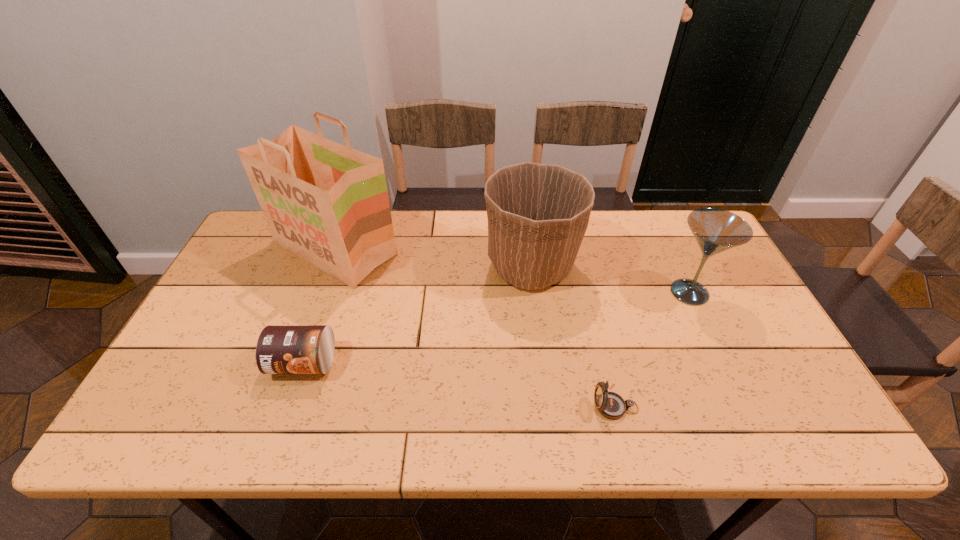
I want to click on free space located 0.160m on the face of the compass, so (x=522, y=407).

Identify the location of vacant region located 0.210m on the face of the compass. (500, 407).

Locate an element on the screen. The image size is (960, 540). vacant point located on the face of the compass is located at coordinates (465, 407).

Identify the location of grocery bag situated at the far edge. The width and height of the screenshot is (960, 540). (327, 203).

I want to click on flowerpot that is at the far edge, so click(x=538, y=214).

Identify the location of object that is at the near edge. Image resolution: width=960 pixels, height=540 pixels. (611, 405).

This screenshot has height=540, width=960. What are the coordinates of `object that is positioned at the left edge` in the screenshot? It's located at (327, 203).

In order to click on object present at the right edge in this screenshot , I will do `click(715, 230)`.

Locate an element on the screen. This screenshot has width=960, height=540. object at the far left corner is located at coordinates (327, 203).

You are a GUI agent. You are given a task and a screenshot of the screen. Output one action in this format:
    pyautogui.click(x=<x>, y=<y>)
    Task: Click on the vacant area at the far edge of the desktop
    
    Given the screenshot: What is the action you would take?
    pyautogui.click(x=434, y=221)